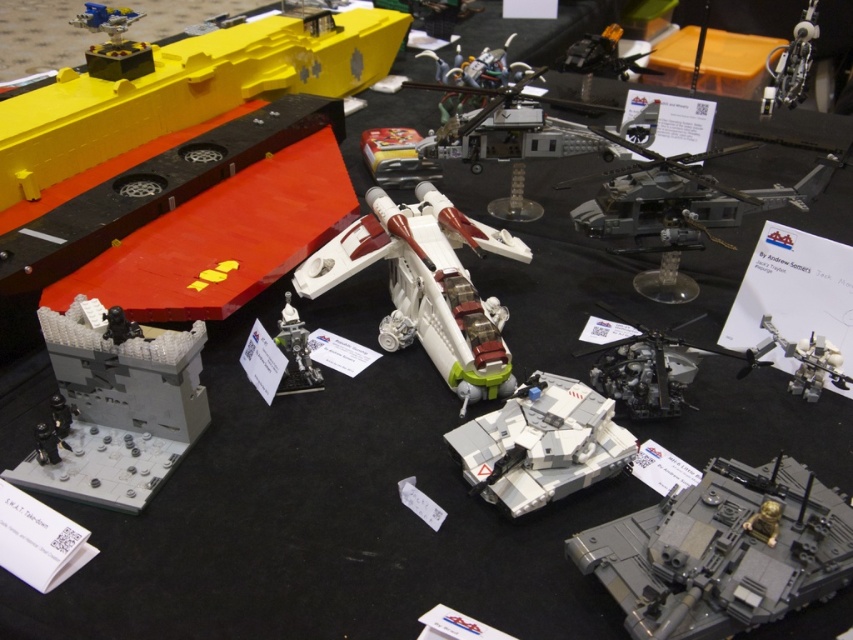
You are a photographer at a LEGO exhibition. You want to take a closeup photo of the metallic gray helicopter at upper right. The camera you are using has a minimum focusing distance of 1 meter. Can you take the photo without moving the helicopter?

The metallic gray helicopter at upper right is 1.28 meters away from camera, which is beyond the minimum focusing distance of 1 meter. Therefore, you can take the closeup photo without moving the helicopter.

You are a photographer trying to capture both the metallic gray helicopter at upper right and the white plastic tank at center in a single shot. Based on their positions and sizes, do you think you can fit both into your camera frame without moving the camera? Explain your reasoning.

The metallic gray helicopter at upper right might be wider than the white plastic tank at center, so there is a possibility that the helicopter could take up more horizontal space. However, since the helicopter is at the upper right and the tank is at the center, their positions might allow both to fit within the frame if the camera has a wide enough angle. The exact fit depends on the actual width comparison between the two, but the description suggests the helicopter could be wider, which might require a

You are a judge at a LEGO competition and need to determine if the white plastic helicopter at center is positioned higher than the metallic gray helicopter at center. Based on the scene description, can you confirm this?

Yes, the white plastic helicopter at center is positioned higher than the metallic gray helicopter at center as it is described to be above the metallic gray helicopter at center.